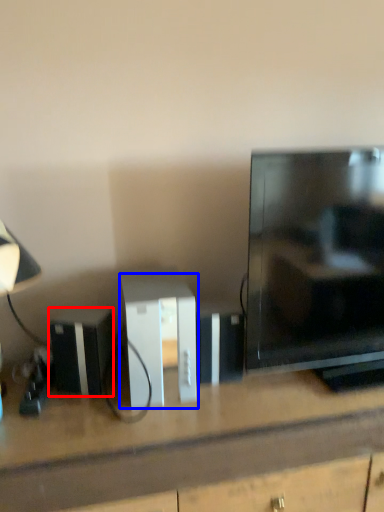
Question: Which object appears farthest to the camera in this image, appliance (highlighted by a red box) or cabinetry (highlighted by a blue box)?

Choices:
 (A) appliance
 (B) cabinetry

Answer: (A)